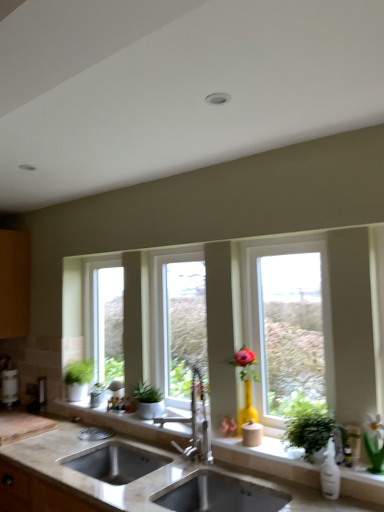
You are a GUI agent. You are given a task and a screenshot of the screen. Output one action in this format:
    pyautogui.click(x=<x>, y=<y>)
    Task: Click on the vacant location below green leafy plant at right, which is counted as the first houseplant, starting from the right (from a real-world perspective)
    
    Given the screenshot: What is the action you would take?
    pyautogui.click(x=295, y=457)